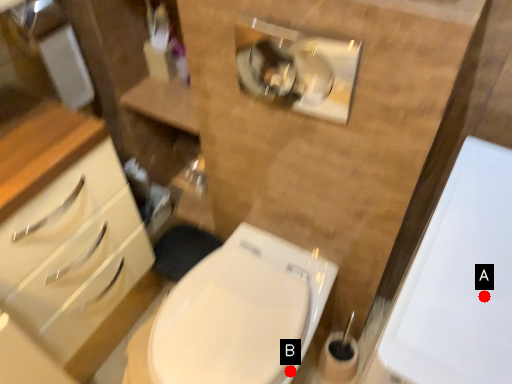
Question: Two points are circled on the image, labeled by A and B beside each circle. Which point is farther to the camera?

Choices:
 (A) A is further
 (B) B is further

Answer: (B)